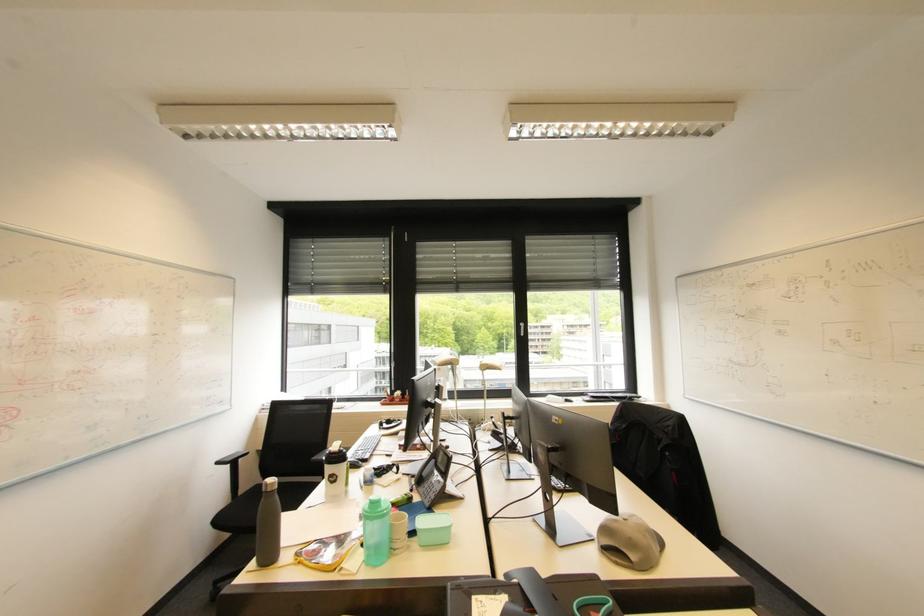
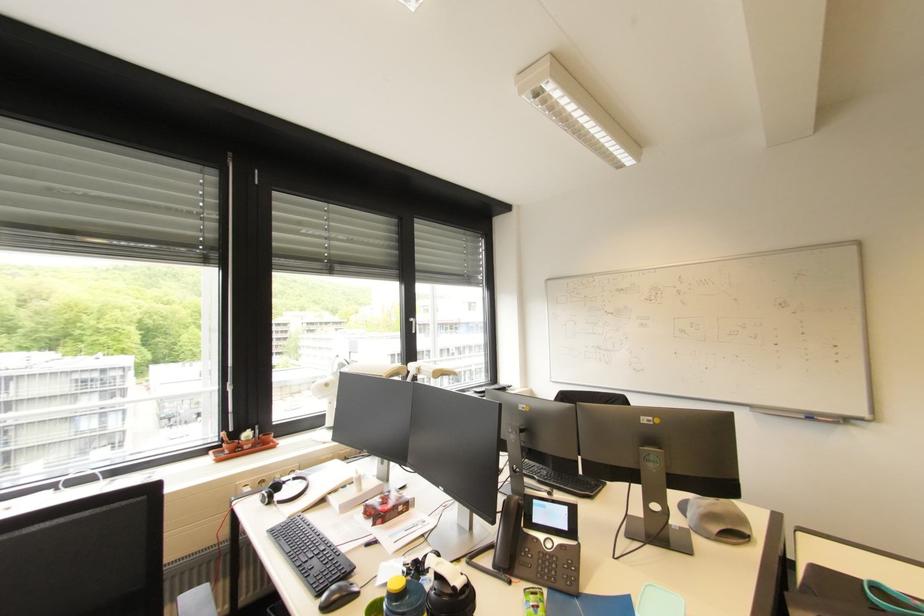
Locate, in the second image, the point that corresponds to pixel 403 395 in the first image.

(252, 438)